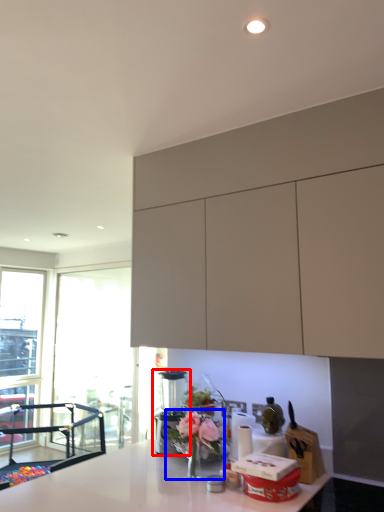
Question: Which object appears farthest to the camera in this image, coffee machine (highlighted by a red box) or floral arrangement (highlighted by a blue box)?

Choices:
 (A) coffee machine
 (B) floral arrangement

Answer: (A)